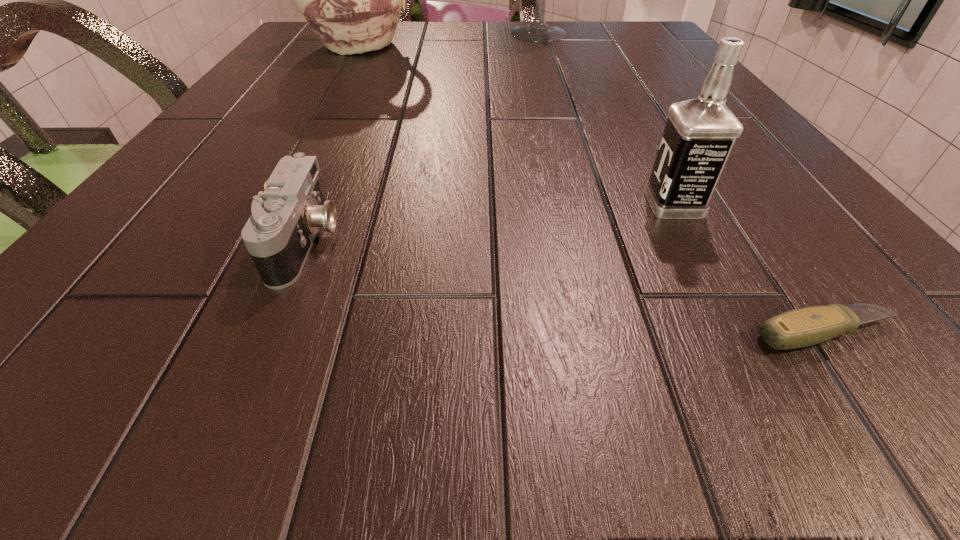
You are a GUI agent. You are given a task and a screenshot of the screen. Output one action in this format:
    pyautogui.click(x=<x>, y=<y>)
    Task: Click on the free space located on the front label of the vodka
    The width and height of the screenshot is (960, 540).
    Given the screenshot: What is the action you would take?
    pyautogui.click(x=460, y=204)

Where is `free space located on the lens of the fourth tallest object`? Image resolution: width=960 pixels, height=540 pixels. free space located on the lens of the fourth tallest object is located at coordinates 460,241.

Where is `blank space located on the left of the nearest object`? Image resolution: width=960 pixels, height=540 pixels. blank space located on the left of the nearest object is located at coordinates (458, 333).

This screenshot has width=960, height=540. In order to click on alcohol present at the far edge in this screenshot , I will do `click(538, 31)`.

Find the location of a particular element. pitcher present at the far edge is located at coordinates (352, 0).

I want to click on object positioned at the near edge, so click(802, 327).

Where is `object located at the left edge`? object located at the left edge is located at coordinates (352, 0).

Where is `vodka at the right edge`? Image resolution: width=960 pixels, height=540 pixels. vodka at the right edge is located at coordinates (699, 135).

The width and height of the screenshot is (960, 540). Identify the location of pocketknife that is at the right edge. (802, 327).

The width and height of the screenshot is (960, 540). Identify the location of object that is at the far left corner. (352, 0).